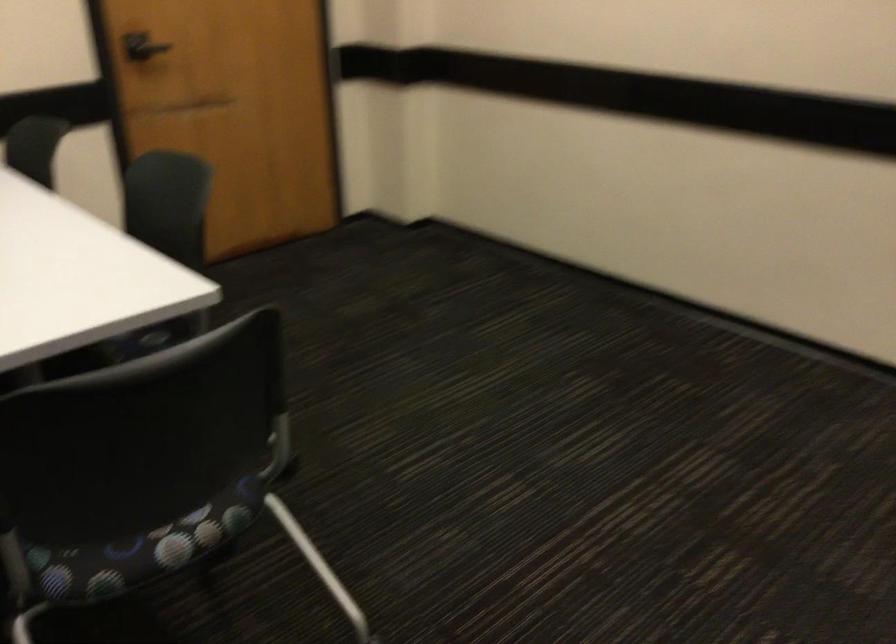
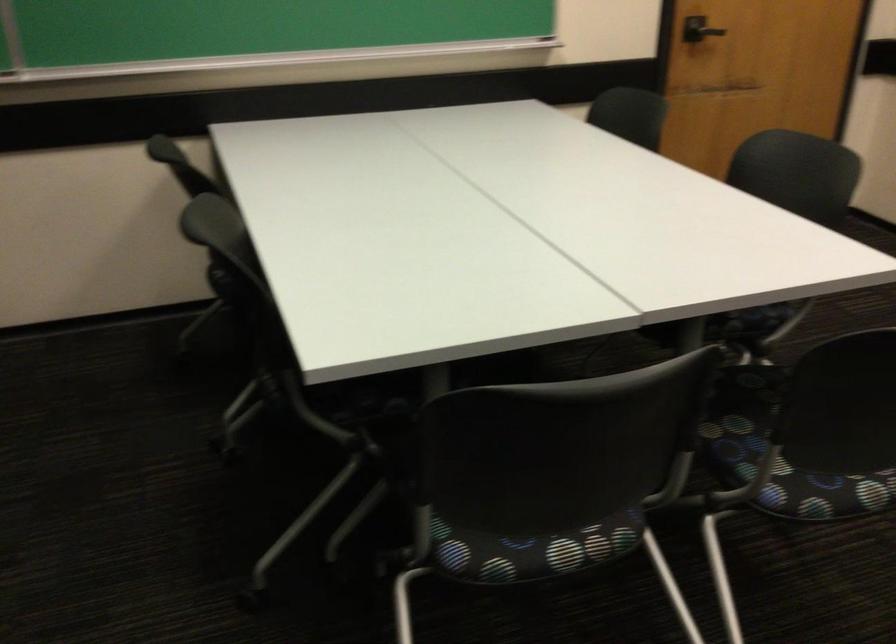
Find the pixel in the second image that matches [118,554] in the first image.

(823, 493)